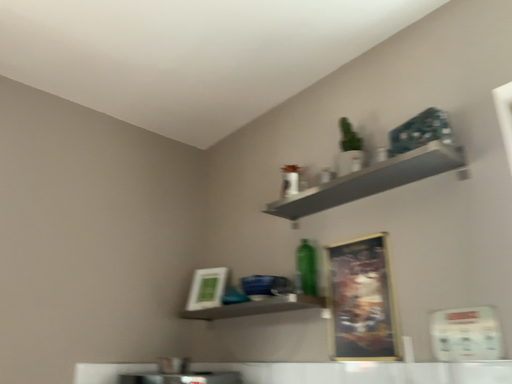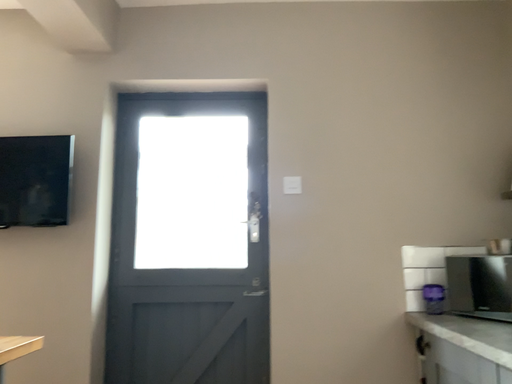
Question: How did the camera likely rotate when shooting the video?

Choices:
 (A) rotated upward
 (B) rotated downward

Answer: (B)